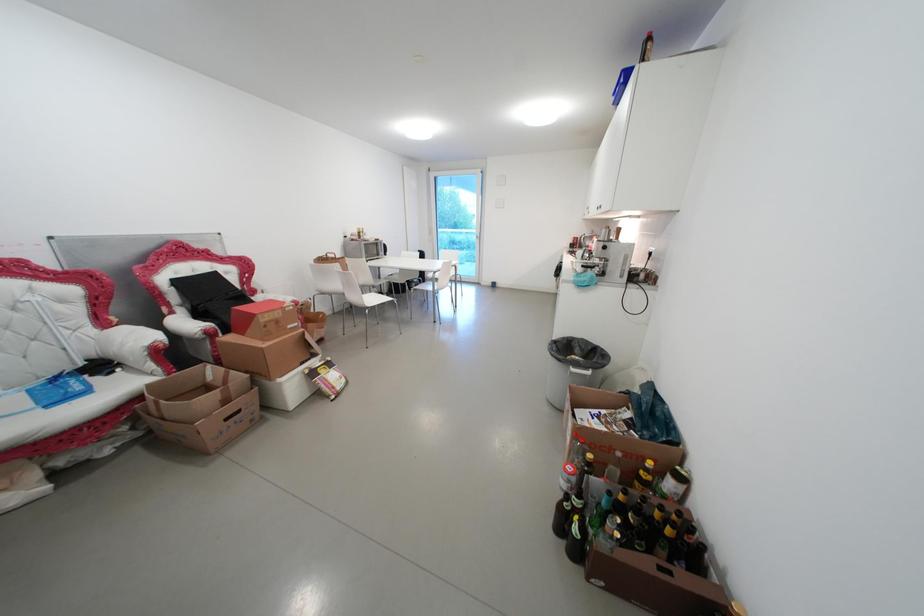
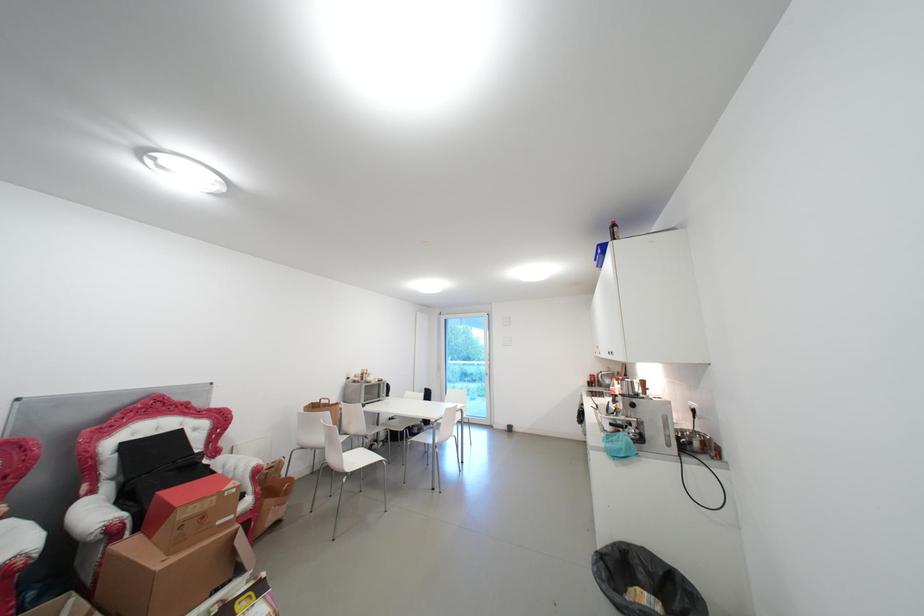
Which direction would the cameraman need to move to produce the second image?

The movement direction of the cameraman is right, forward.